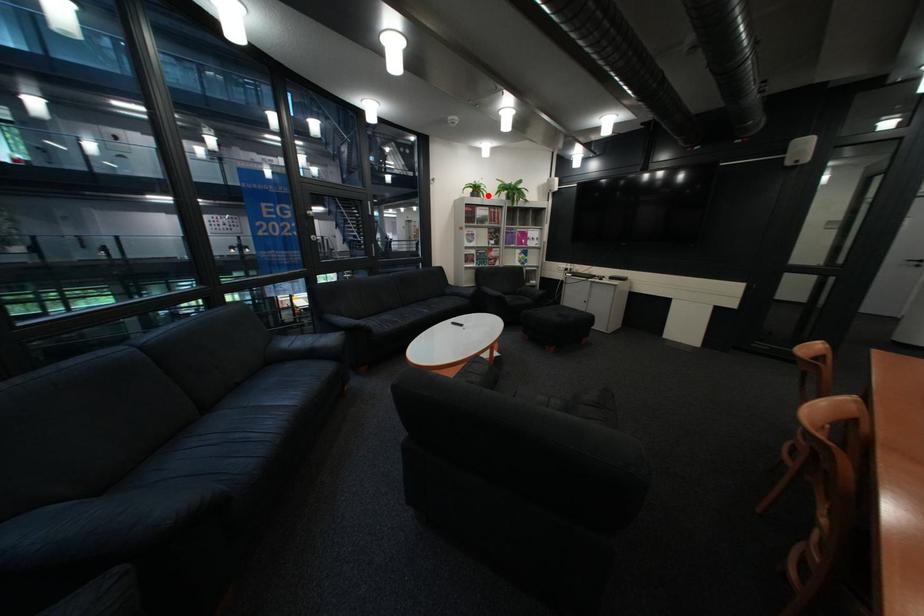
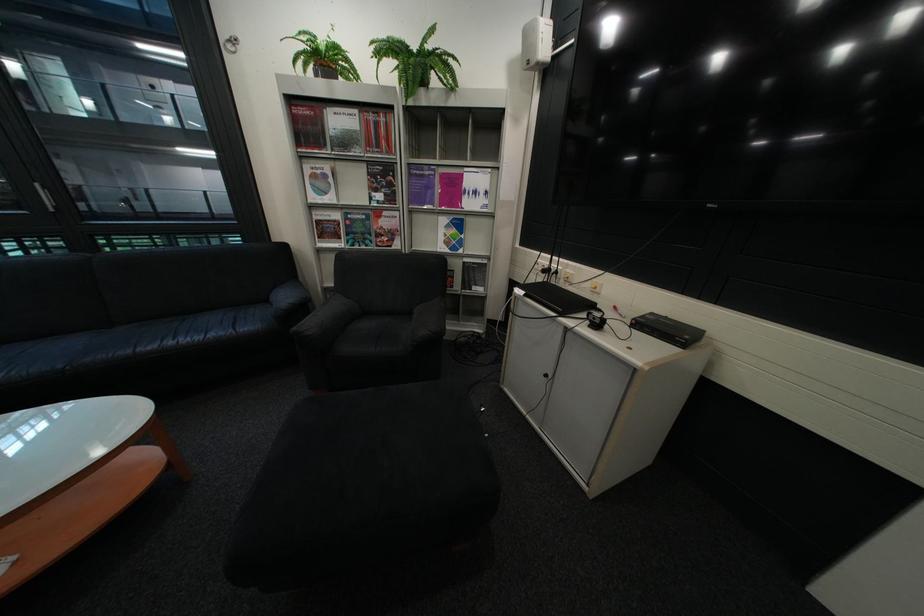
Find the pixel in the second image that matches the highlighted location in the first image.

(333, 78)